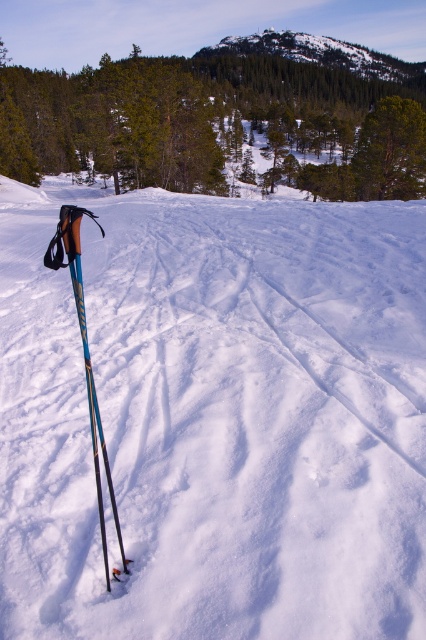
The width and height of the screenshot is (426, 640). I want to click on snowy rocky hill at upper center, so click(x=317, y=52).

Does snowy rocky hill at upper center have a greater height compared to blue metallic ski pole at left?

Correct, snowy rocky hill at upper center is much taller as blue metallic ski pole at left.

The height and width of the screenshot is (640, 426). What do you see at coordinates (317, 52) in the screenshot?
I see `snowy rocky hill at upper center` at bounding box center [317, 52].

Where is `snowy rocky hill at upper center`? The height and width of the screenshot is (640, 426). snowy rocky hill at upper center is located at coordinates (317, 52).

Describe the element at coordinates (215, 417) in the screenshot. I see `white fluffy snow at center` at that location.

Can you confirm if white fluffy snow at center is positioned to the right of blue metallic ski pole at left?

Answer: Correct, you'll find white fluffy snow at center to the right of blue metallic ski pole at left.

This screenshot has height=640, width=426. Describe the element at coordinates (215, 417) in the screenshot. I see `white fluffy snow at center` at that location.

Where is `white fluffy snow at center`? Image resolution: width=426 pixels, height=640 pixels. white fluffy snow at center is located at coordinates (215, 417).

Does white fluffy snow at center appear over snowy rocky hill at upper center?

Actually, white fluffy snow at center is below snowy rocky hill at upper center.

Does white fluffy snow at center have a lesser height compared to snowy rocky hill at upper center?

Yes.

Identify the location of white fluffy snow at center. click(x=215, y=417).